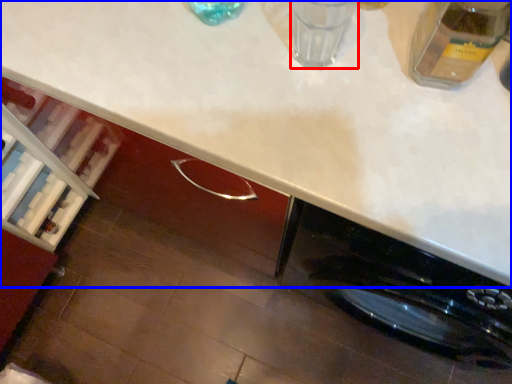
Question: Which of the following is the closest to the observer, water (highlighted by a red box) or countertop (highlighted by a blue box)?

Choices:
 (A) water
 (B) countertop

Answer: (B)